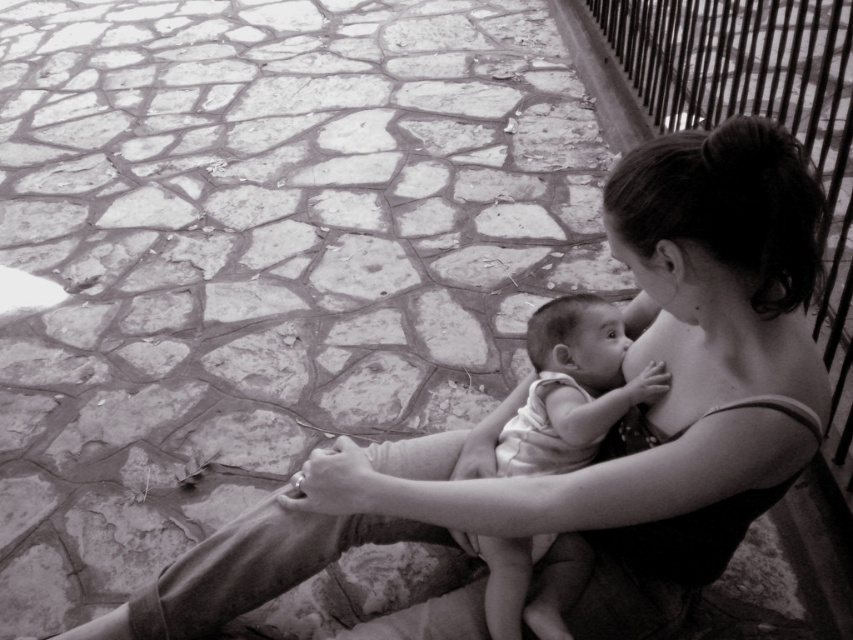
Does metallic wire fence at upper right have a greater height compared to white clothed baby at center?

Indeed, metallic wire fence at upper right has a greater height compared to white clothed baby at center.

Which is more to the right, metallic wire fence at upper right or white clothed baby at center?

metallic wire fence at upper right

Who is more forward, (606, 26) or (567, 577)?

Point (567, 577) is more forward.

Locate an element on the screen. The height and width of the screenshot is (640, 853). metallic wire fence at upper right is located at coordinates (753, 113).